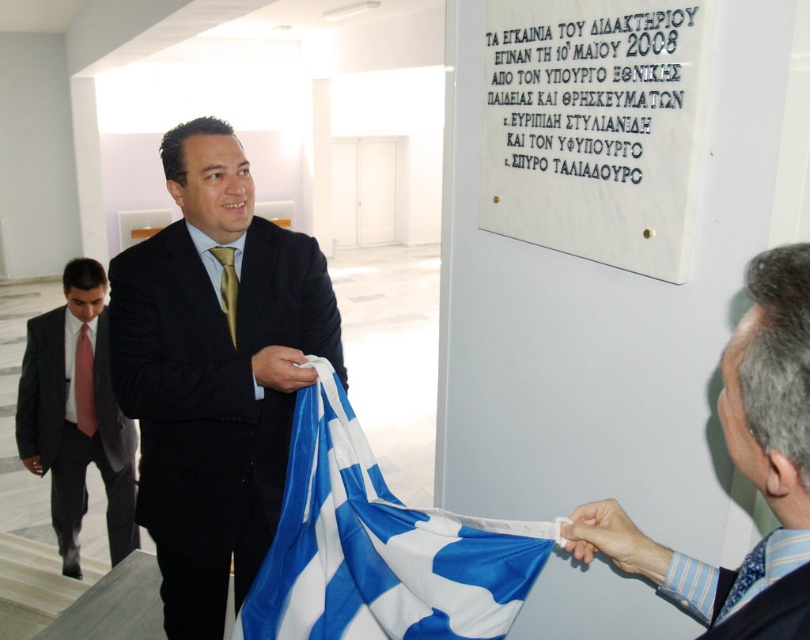
You are a tailor measuring the width of clothing items in the image. You need to determine which item is wider between the dark gray suit at left and the gold silk tie at center. Which one is wider?

The dark gray suit at left is wider than the gold silk tie at center according to the description.

You are organizing a formal event and need to decide which tie to use for the speaker. The blue silk tie at upper right and the red satin tie at center are options. Which tie is shorter?

The blue silk tie at upper right is shorter than the red satin tie at center, so the blue silk tie at upper right should be chosen if a shorter length is preferred.